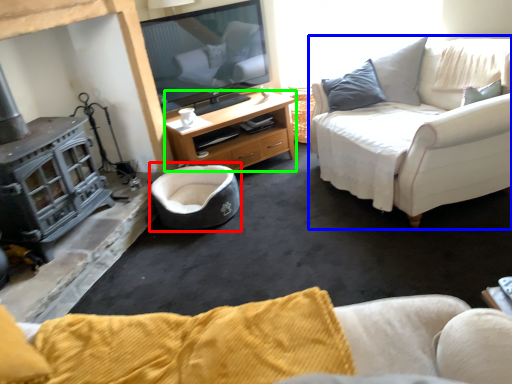
Question: Which is nearer to the bean bag chair (highlighted by a red box)? studio couch (highlighted by a blue box) or desk (highlighted by a green box).

Choices:
 (A) studio couch
 (B) desk

Answer: (B)